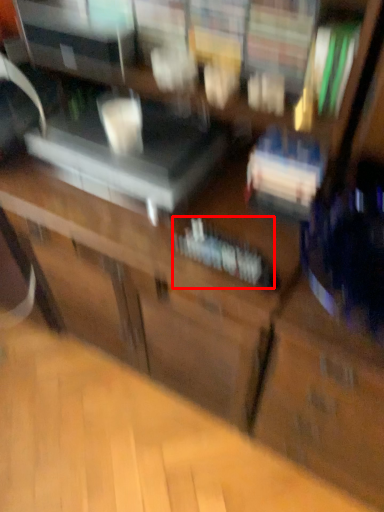
Question: Considering the relative positions of book (annotated by the red box) and furniture in the image provided, where is book (annotated by the red box) located with respect to the staircase?

Choices:
 (A) left
 (B) right

Answer: (B)